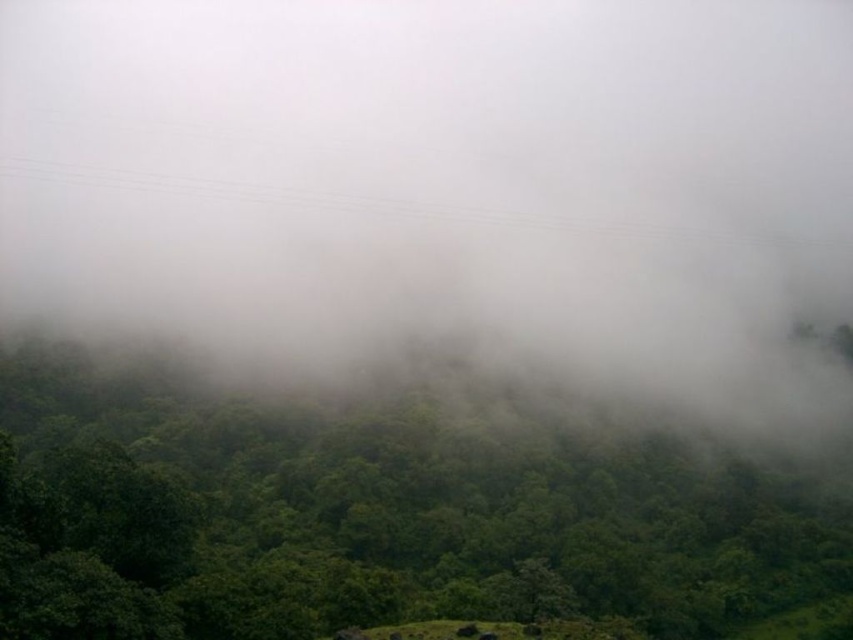
You are standing in the misty landscape described. You notice a point marked at coordinates (447, 184). What object or feature is located at that exact point?

The point at coordinates (447, 184) indicates white misty fog at center.

You are an explorer navigating through a misty forest. You notice a white misty fog at center and a green leafy tree at center. Which of these two elements is more prominent in terms of visual size within the scene?

The white misty fog at center is larger in size than the green leafy tree at center, making it more prominent in visual size within the scene.